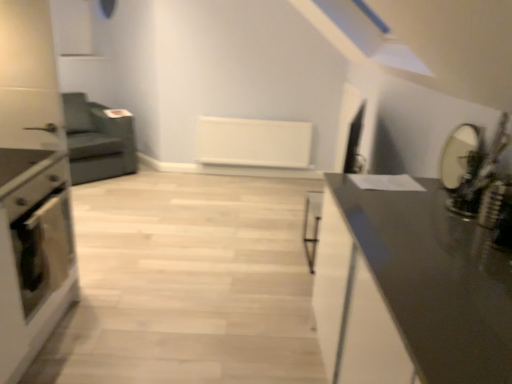
The image size is (512, 384). In order to click on blank space to the left of matte black mirror at right in this screenshot , I will do `click(408, 191)`.